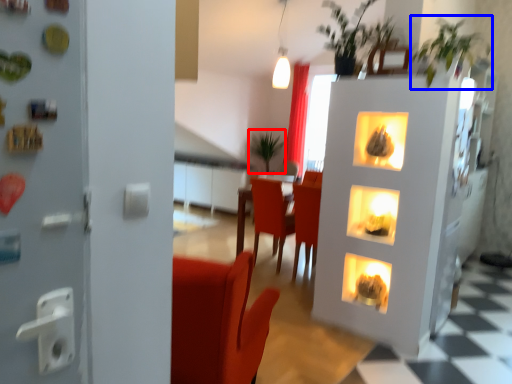
Question: Which object appears closest to the camera in this image, plant (highlighted by a red box) or plant (highlighted by a blue box)?

Choices:
 (A) plant
 (B) plant

Answer: (B)